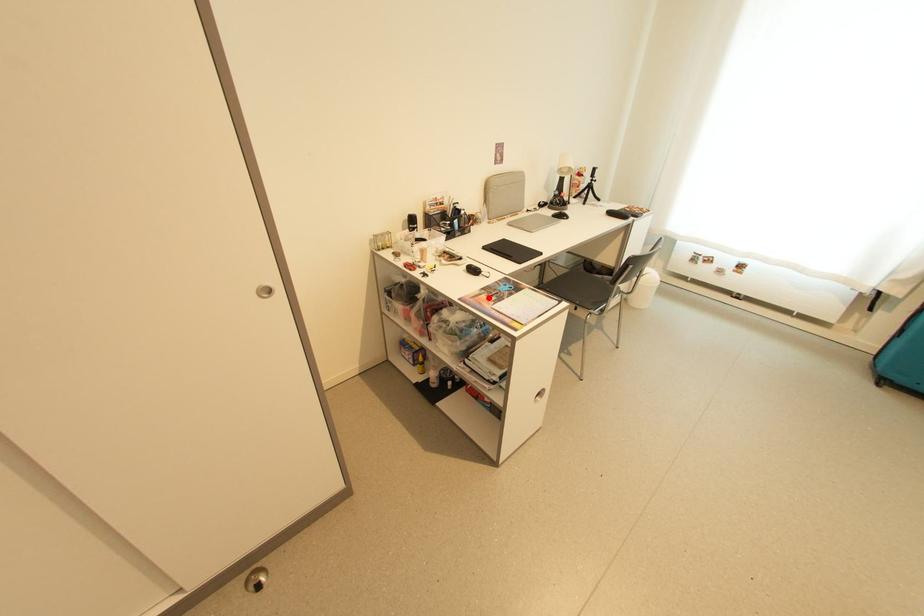
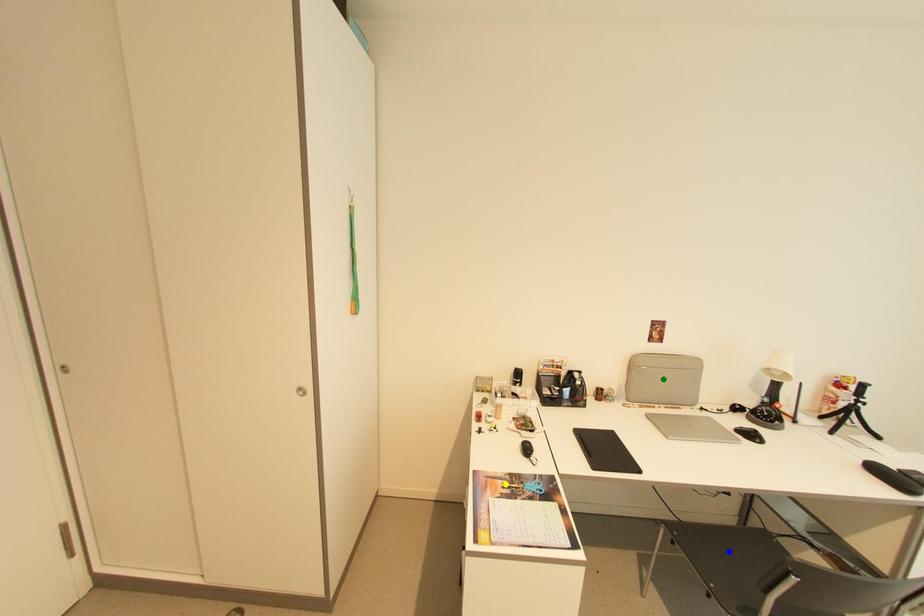
Question: I am providing you with two images of the same scene from different viewpoints. A red point is marked on the first image. You are given multiple points on the second image. Which point in image 2 is actually the same real-world point as the red point in image 1?

Choices:
 (A) yellow point
 (B) blue point
 (C) green point

Answer: (A)